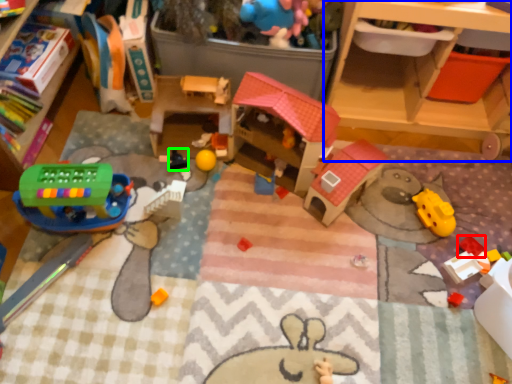
Question: Which is nearer to the toy (highlighted by a red box)? shelf (highlighted by a blue box) or toy (highlighted by a green box).

Choices:
 (A) shelf
 (B) toy

Answer: (A)